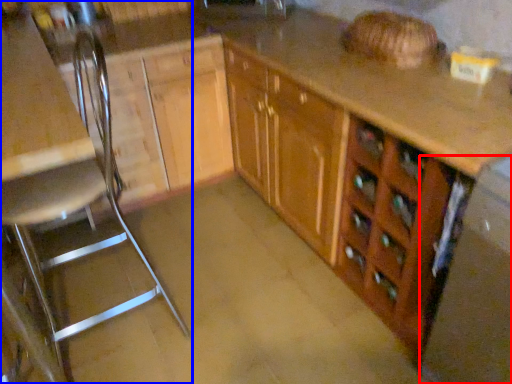
Question: Which object appears farthest to the camera in this image, appliance (highlighted by a red box) or chair (highlighted by a blue box)?

Choices:
 (A) appliance
 (B) chair

Answer: (B)